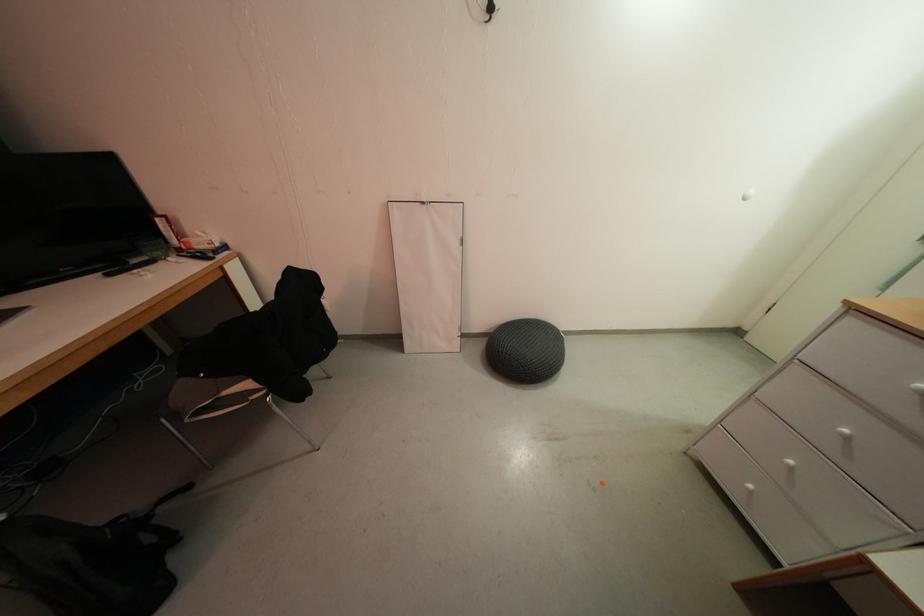
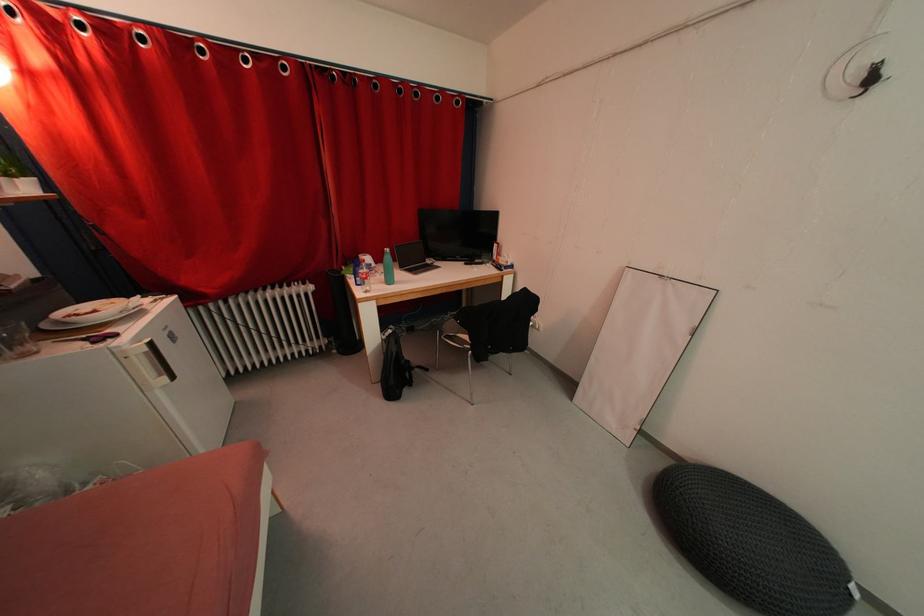
Question: The camera is either moving clockwise (left) or counter-clockwise (right) around the object. The first image is from the beginning of the video and the second image is from the end. Is the camera moving left or right when shooting the video?

Choices:
 (A) Left
 (B) Right

Answer: (B)